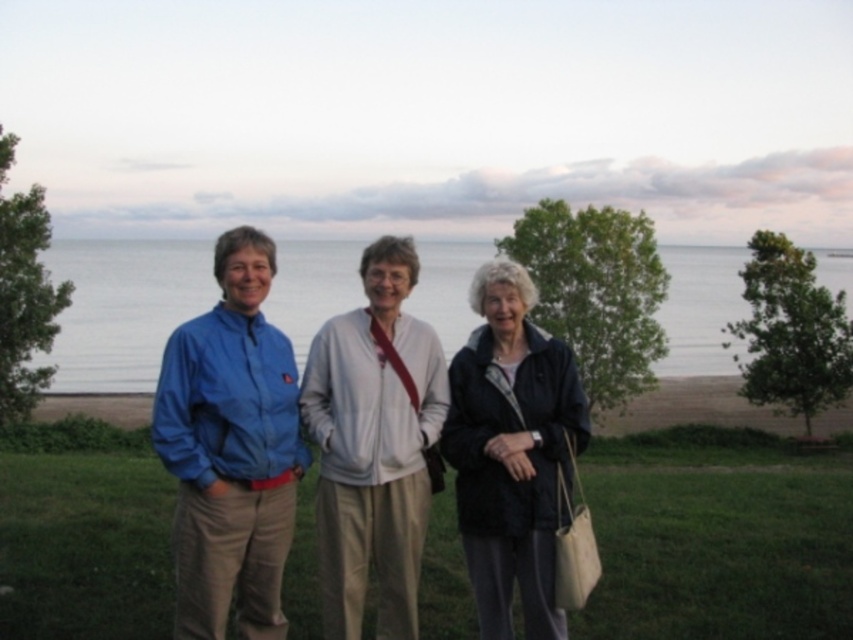
Question: Which object is closer to the camera taking this photo?

Choices:
 (A) blue water at center
 (B) white matte jacket at center
 (C) green grass at center

Answer: (B)

Question: Which object appears closest to the camera in this image?

Choices:
 (A) blue fabric jacket at center
 (B) white matte jacket at center
 (C) blue fabric jacket at left
 (D) green grass at center

Answer: (A)

Question: Is green grass at center positioned behind dark blue jacket at center?

Choices:
 (A) no
 (B) yes

Answer: (B)

Question: Does green grass at center have a lesser width compared to white matte jacket at center?

Choices:
 (A) yes
 (B) no

Answer: (B)

Question: Which of the following is the farthest from the observer?

Choices:
 (A) blue fabric jacket at center
 (B) blue fabric jacket at left
 (C) green grass at center

Answer: (C)

Question: Does green grass at center have a smaller size compared to blue water at center?

Choices:
 (A) no
 (B) yes

Answer: (B)